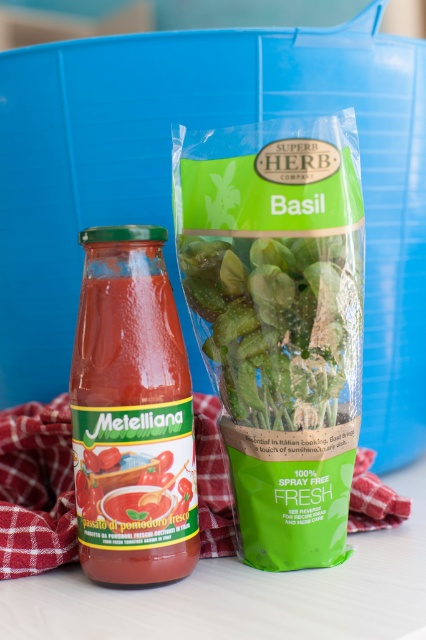
Does translucent glass jar of tomato sauce at center appear on the right side of green leafy basil at center?

In fact, translucent glass jar of tomato sauce at center is to the left of green leafy basil at center.

Is translucent glass jar of tomato sauce at center positioned before green leafy basil at center?

No, it is behind green leafy basil at center.

At what (x,y) coordinates should I click in order to perform the action: click on translucent glass jar of tomato sauce at center. Please return your answer as a coordinate pair (x, y). This screenshot has width=426, height=640. Looking at the image, I should click on (x=132, y=413).